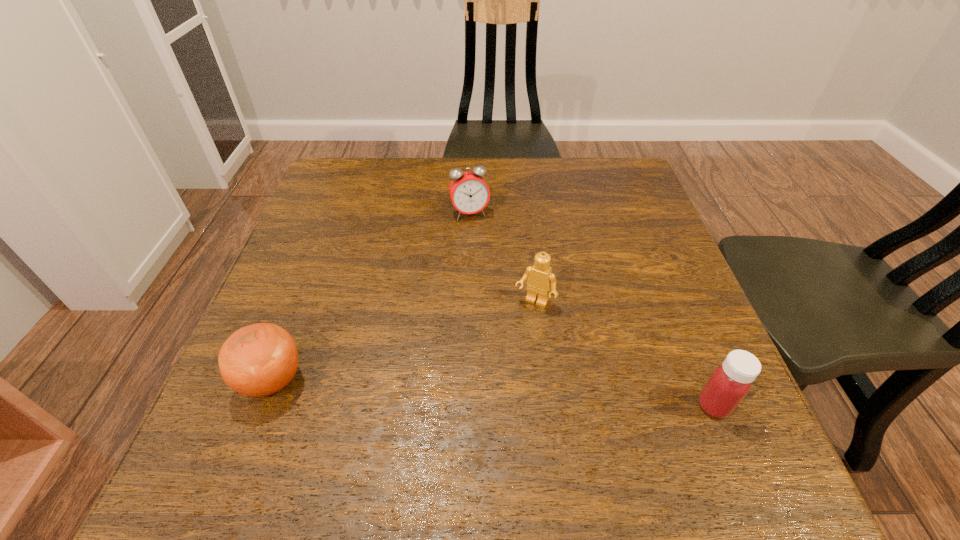
Find the location of `free space at the far edge of the desktop`. free space at the far edge of the desktop is located at coordinates (393, 200).

The height and width of the screenshot is (540, 960). In the image, there is a desktop. Find the location of `vacant space at the near edge`. vacant space at the near edge is located at coordinates (551, 383).

This screenshot has width=960, height=540. In order to click on vacant space at the left edge of the desktop in this screenshot , I will do `click(322, 323)`.

What are the coordinates of `vacant space at the right edge` in the screenshot? It's located at (675, 292).

Locate an element on the screen. Image resolution: width=960 pixels, height=540 pixels. free location at the far left corner is located at coordinates (352, 195).

Locate an element on the screen. Image resolution: width=960 pixels, height=540 pixels. vacant space that is in between the leftmost object and the medicine is located at coordinates (493, 393).

Image resolution: width=960 pixels, height=540 pixels. I want to click on empty space that is in between the orange and the medicine, so click(x=493, y=393).

Locate an element on the screen. This screenshot has width=960, height=540. empty space between the orange and the medicine is located at coordinates (493, 393).

The width and height of the screenshot is (960, 540). I want to click on vacant space in between the rightmost object and the farthest object, so click(x=591, y=309).

Locate an element on the screen. The width and height of the screenshot is (960, 540). vacant point located between the second farthest object and the medicine is located at coordinates (624, 354).